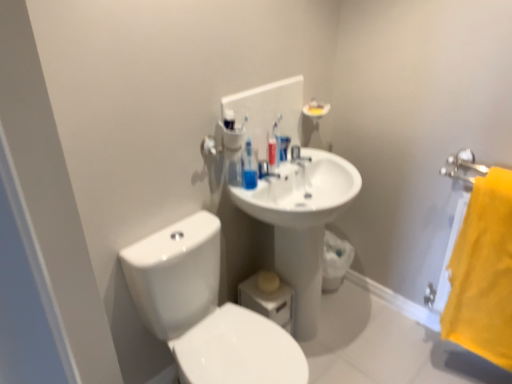
Question: In terms of size, does white glossy sink at center appear bigger or smaller than translucent plastic toothbrushes at upper center?

Choices:
 (A) small
 (B) big

Answer: (A)

Question: Considering their positions, is white glossy sink at center located in front of or behind translucent plastic toothbrushes at upper center?

Choices:
 (A) front
 (B) behind

Answer: (B)

Question: Estimate the real-world distances between objects in this image. Which object is farther from the translucent plastic toothbrushes at upper center?

Choices:
 (A) white glossy sink at center
 (B) white glossy sink at center
 (C) yellow fabric towel at right
 (D) blue plastic mouthwash at center
 (E) white glossy toilet at lower left

Answer: (C)

Question: Estimate the real-world distances between objects in this image. Which object is closer to the blue plastic mouthwash at center?

Choices:
 (A) white glossy sink at center
 (B) white glossy sink at center
 (C) yellow fabric towel at right
 (D) white glossy toilet at lower left
 (E) translucent plastic toothbrushes at upper center

Answer: (A)